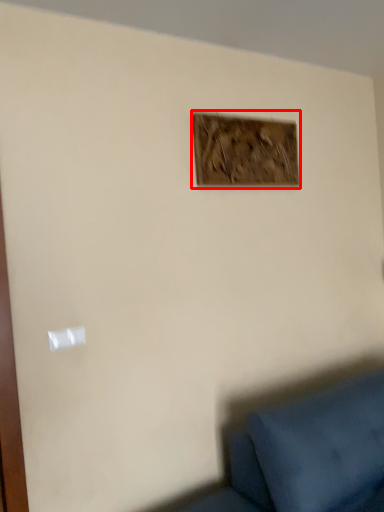
Question: From the image's perspective, where is picture frame (annotated by the red box) located relative to light switch?

Choices:
 (A) above
 (B) below

Answer: (A)